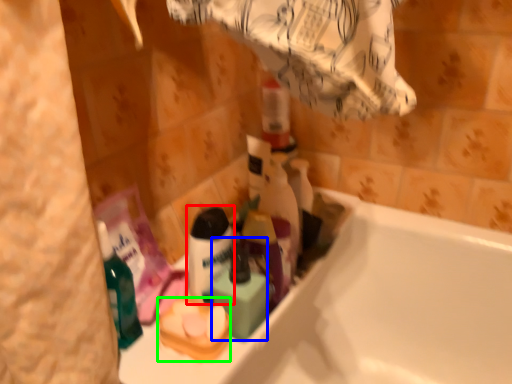
Question: Which object is the farthest from shaving cream (highlighted by a red box)? Choose among these: mouthwash (highlighted by a blue box) or product (highlighted by a green box).

Choices:
 (A) mouthwash
 (B) product

Answer: (B)